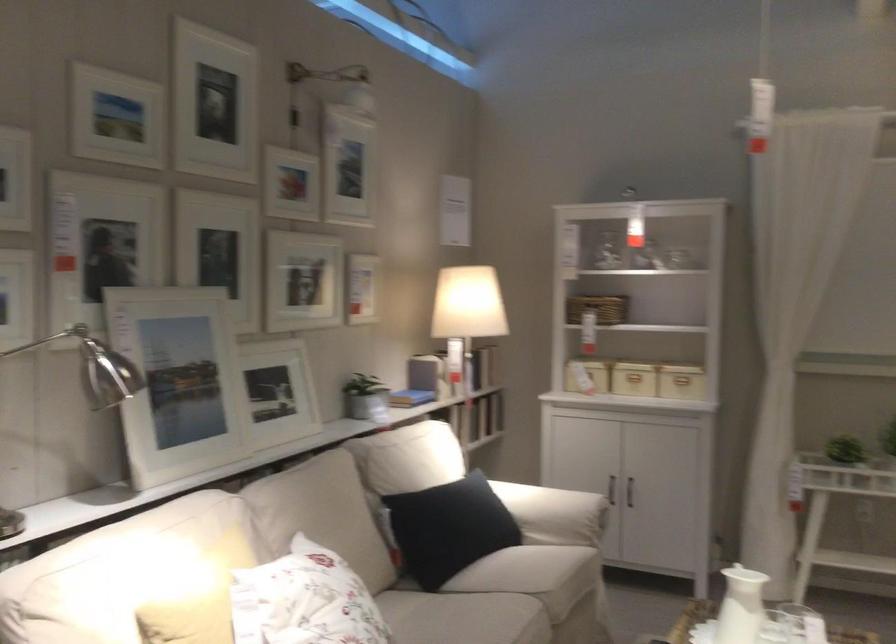
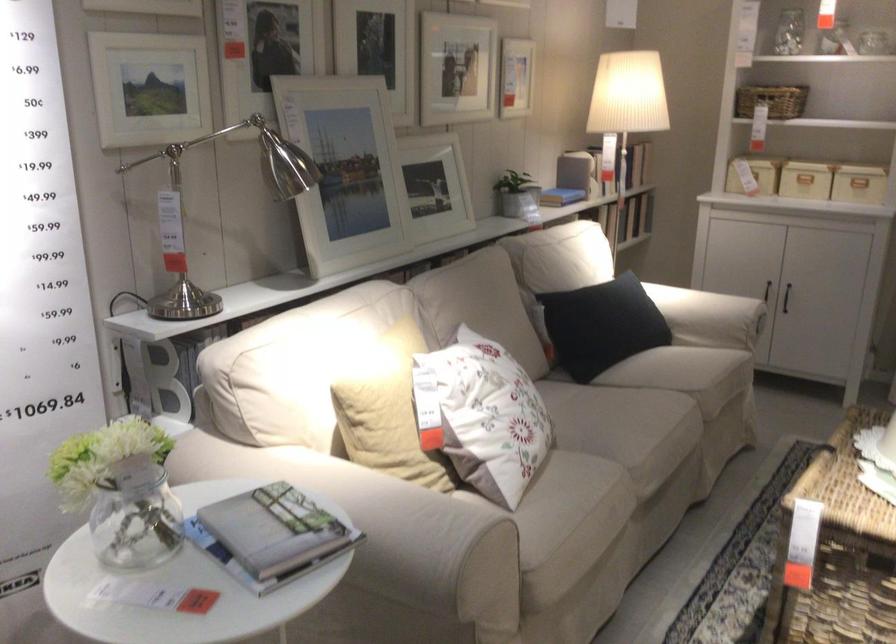
In the second image, find the point that corresponds to (631,502) in the first image.

(786, 297)